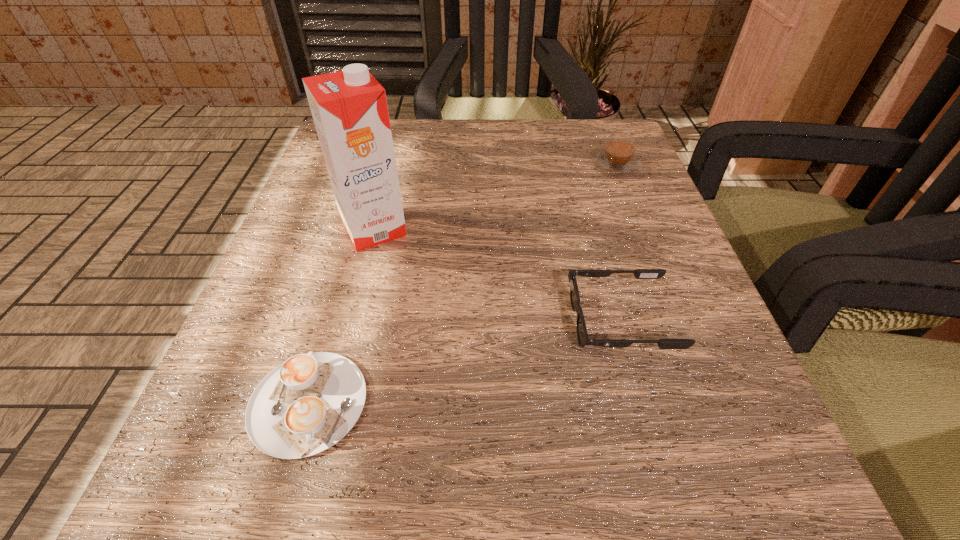
Locate an element on the screen. The height and width of the screenshot is (540, 960). object that is at the far right corner is located at coordinates pyautogui.click(x=618, y=159).

This screenshot has height=540, width=960. In the image, there is a desktop. Identify the location of free space at the far edge. (492, 160).

The height and width of the screenshot is (540, 960). In the image, there is a desktop. Identify the location of vacant region at the near edge. (520, 497).

Identify the location of blank area at the left edge. (244, 447).

In order to click on free point at the right edge in this screenshot , I will do `click(637, 307)`.

In the image, there is a desktop. What are the coordinates of `vacant space at the near left corner` in the screenshot? It's located at (195, 502).

Image resolution: width=960 pixels, height=540 pixels. In order to click on vacant space at the far right corner of the desktop in this screenshot , I will do `click(569, 120)`.

Where is `vacant space at the near right corner of the desktop`? The width and height of the screenshot is (960, 540). vacant space at the near right corner of the desktop is located at coordinates (701, 483).

Identify the location of free space between the farthest object and the sunglasses. The image size is (960, 540). (618, 244).

The image size is (960, 540). I want to click on empty space that is in between the right cappuccino and the sunglasses, so [x=618, y=244].